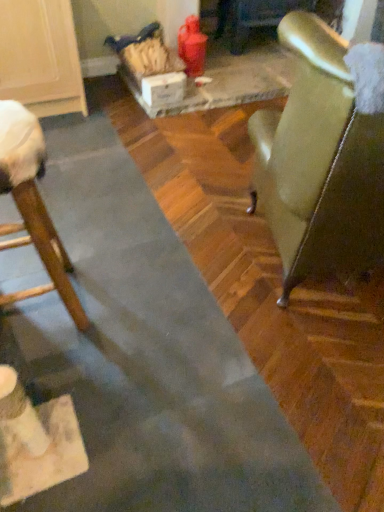
Identify the location of vacant area that is situated to the right of white cardboard box at center. (188, 100).